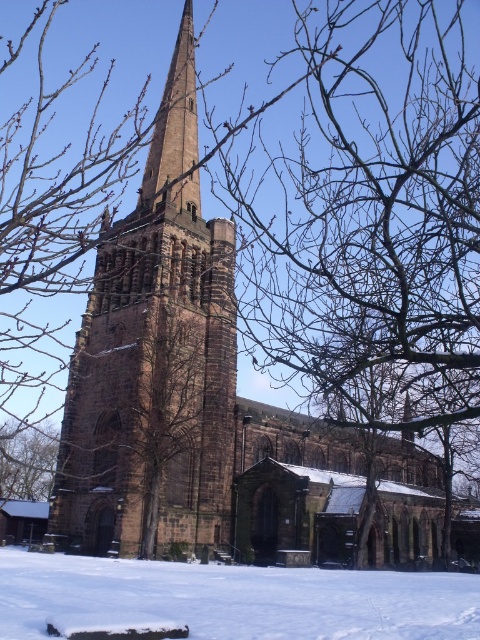
This screenshot has width=480, height=640. I want to click on brown stone tower at center, so click(x=155, y=358).

Based on the photo, how far apart are brown stone tower at center and brown textured tree at lower left?

26.32 meters

Describe the element at coordinates (155, 358) in the screenshot. This screenshot has width=480, height=640. I see `brown stone tower at center` at that location.

Find the location of `brown stone tower at center`. brown stone tower at center is located at coordinates (155, 358).

Is white powdery snow at lower center positioned behind brown textured tree at lower left?

No, white powdery snow at lower center is closer to the viewer.

I want to click on white powdery snow at lower center, so click(239, 598).

Image resolution: width=480 pixels, height=640 pixels. Find the location of `white powdery snow at lower center`. white powdery snow at lower center is located at coordinates (239, 598).

Can you confirm if brown stone tower at center is smaller than white powdery snow at lower center?

Actually, brown stone tower at center might be larger than white powdery snow at lower center.

Does brown stone tower at center appear on the left side of white powdery snow at lower center?

Indeed, brown stone tower at center is positioned on the left side of white powdery snow at lower center.

Who is more distant from viewer, (201, 474) or (60, 611)?

The point (201, 474) is more distant.

Locate an element on the screen. This screenshot has width=480, height=640. brown stone tower at center is located at coordinates (155, 358).